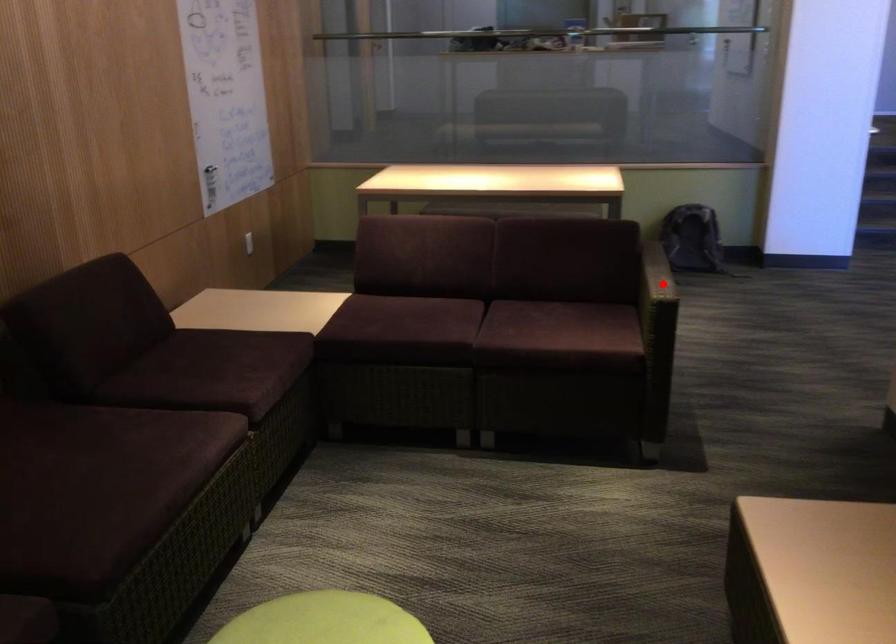
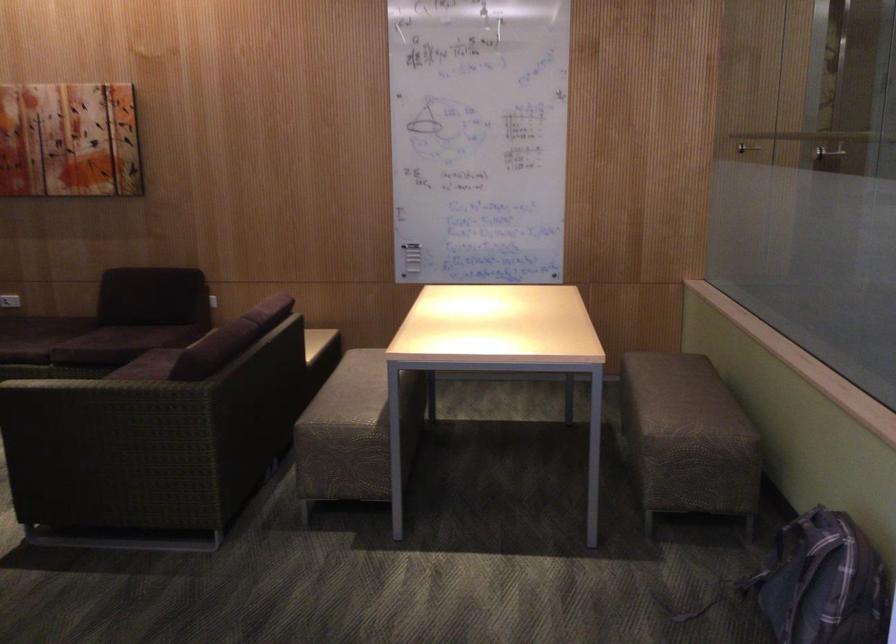
The point at the highlighted location is marked in the first image. Where is the corresponding point in the second image?

(96, 382)